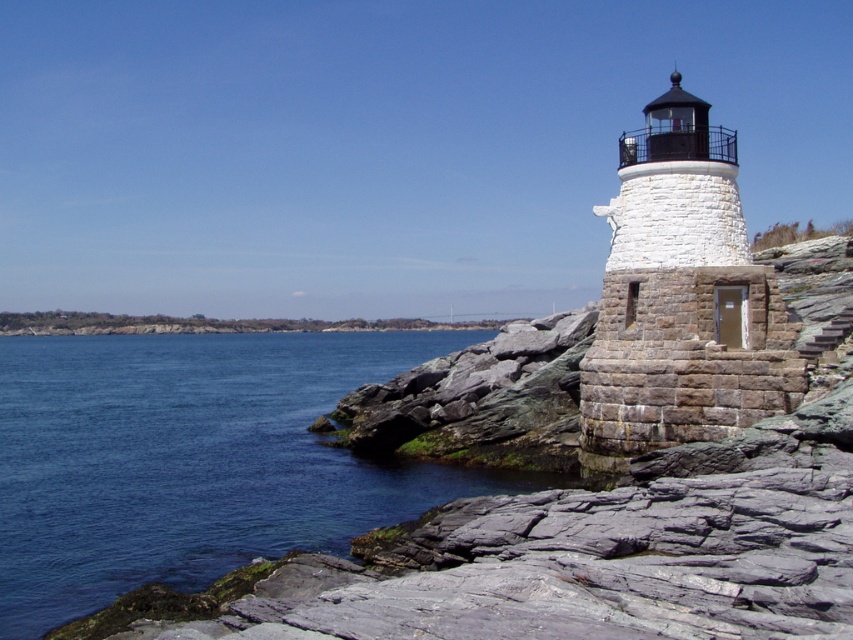
Who is positioned more to the right, blue water at lower left or gray stone stairs at right?

From the viewer's perspective, gray stone stairs at right appears more on the right side.

Does point (233, 340) lie in front of point (842, 324)?

No, it is not.

Identify the location of blue water at lower left. (192, 460).

Between blue water at lower left and white stone lighthouse at right, which one is positioned lower?

blue water at lower left is lower down.

Is blue water at lower left positioned in front of white stone lighthouse at right?

That is True.

The height and width of the screenshot is (640, 853). What do you see at coordinates (192, 460) in the screenshot? I see `blue water at lower left` at bounding box center [192, 460].

Identify the location of blue water at lower left. click(192, 460).

Is white stone lighthouse at right further to camera compared to gray stone stairs at right?

Yes, white stone lighthouse at right is further from the viewer.

How distant is white stone lighthouse at right from gray stone stairs at right?

white stone lighthouse at right is 2.71 meters away from gray stone stairs at right.

Image resolution: width=853 pixels, height=640 pixels. In order to click on white stone lighthouse at right in this screenshot , I will do `click(682, 298)`.